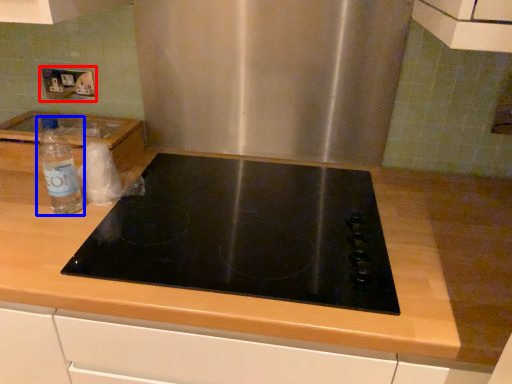
Question: Which object is closer to the camera taking this photo, electric outlet (highlighted by a red box) or bottle (highlighted by a blue box)?

Choices:
 (A) electric outlet
 (B) bottle

Answer: (B)